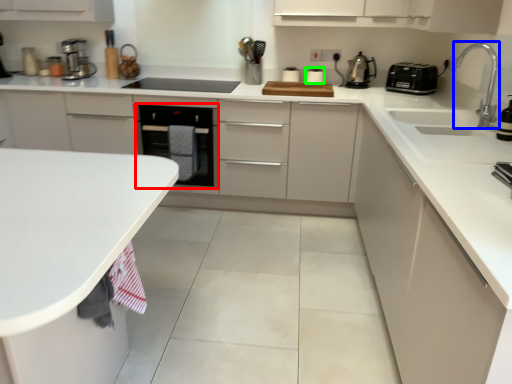
Question: Estimate the real-world distances between objects in this image. Which object is closer to home appliance (highlighted by a red box), tap (highlighted by a blue box) or appliance (highlighted by a green box)?

Choices:
 (A) tap
 (B) appliance

Answer: (B)